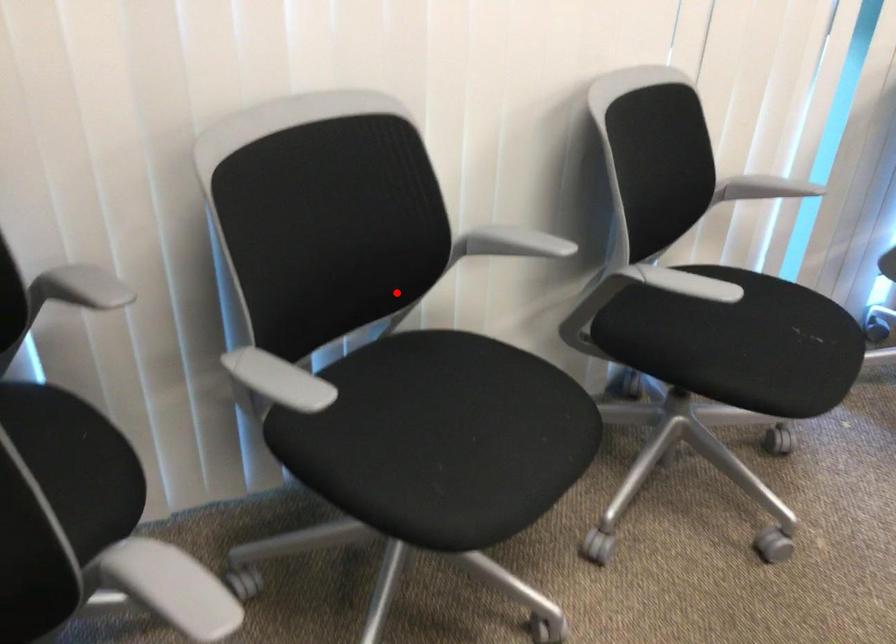
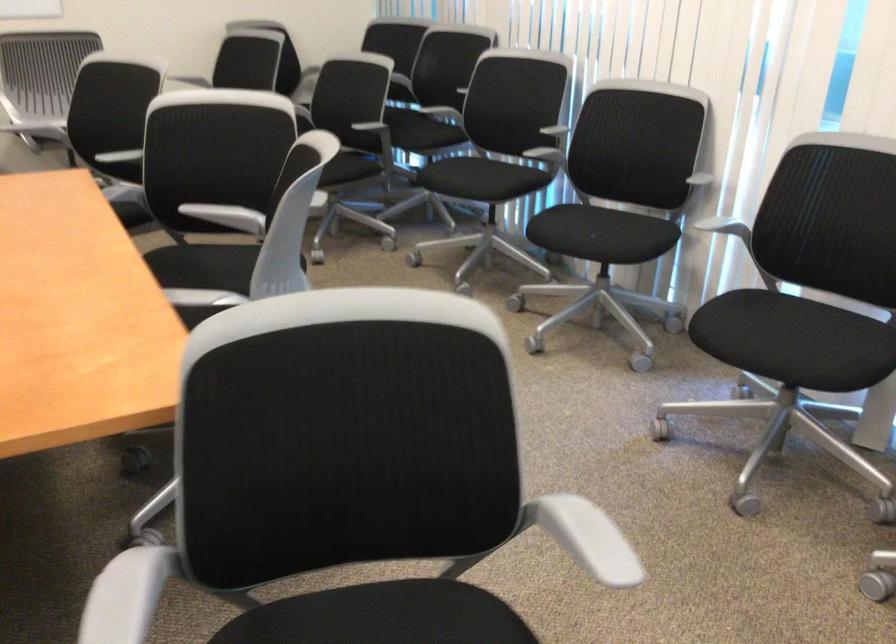
In the second image, find the point that corresponds to the highlighted location in the first image.

(543, 146)